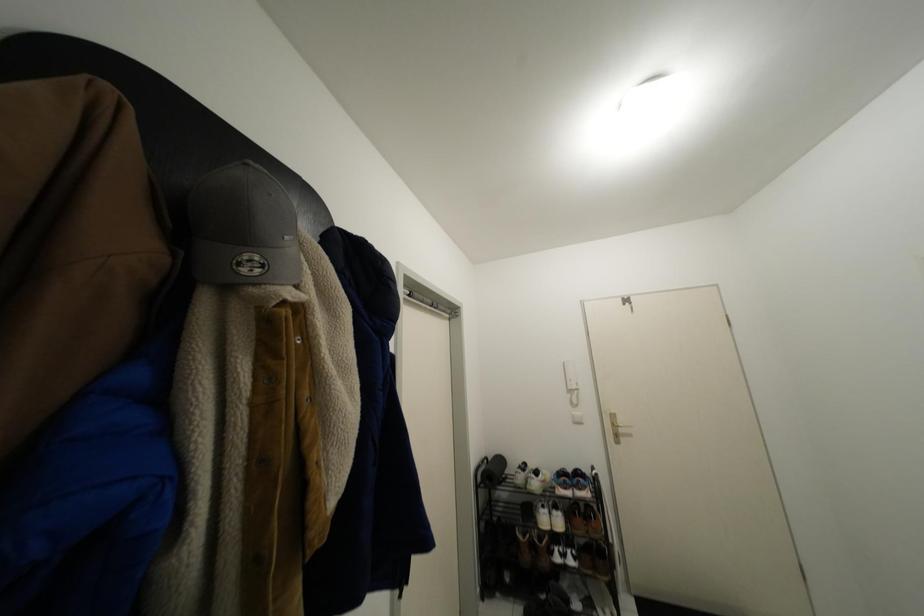
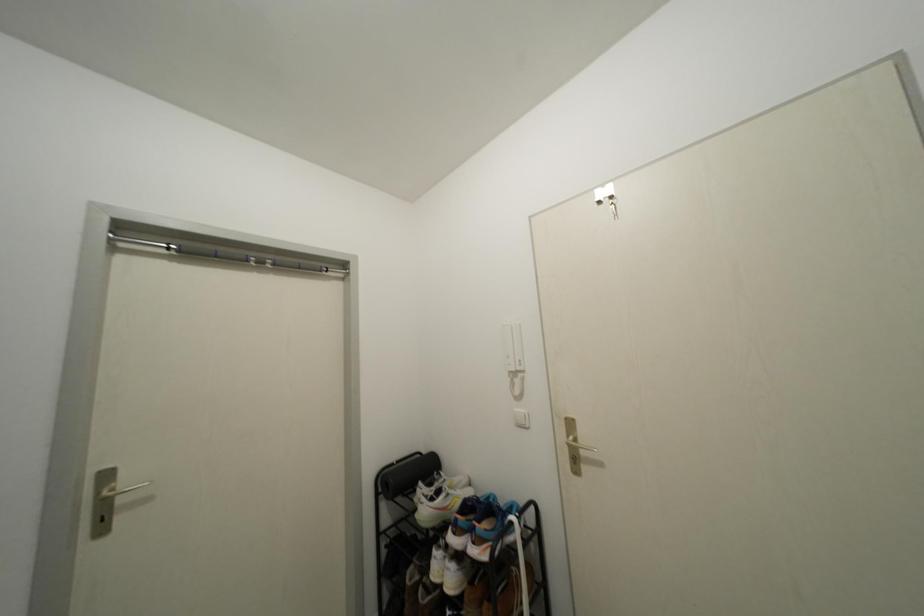
In a continuous first-person perspective shot, in which direction is the camera moving?

The movement direction of the cameraman is right, forward.